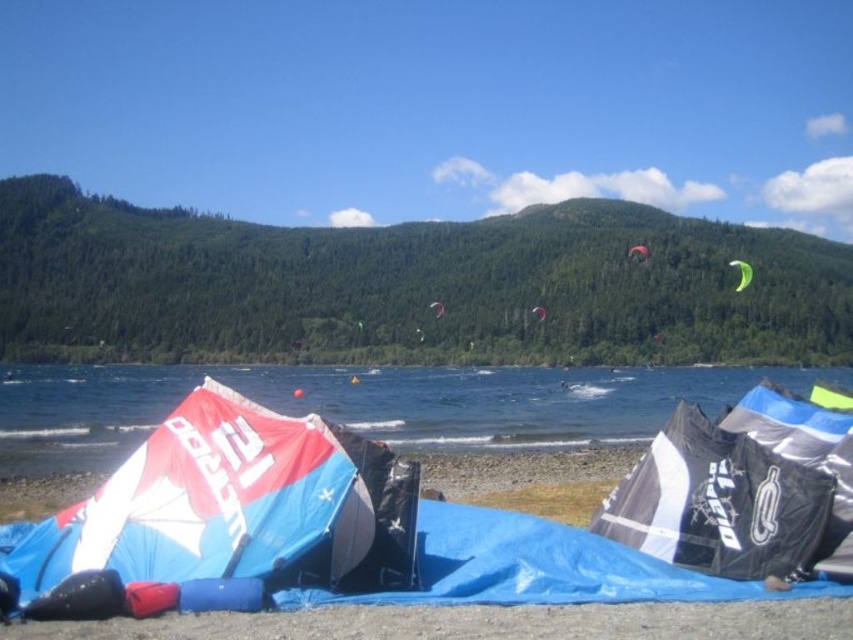
Can you confirm if black matte kite at right is shorter than white matte parachute at center?

Yes.

Is black matte kite at right bigger than white matte parachute at center?

No.

Who is more distant from viewer, (730, 508) or (437, 314)?

Point (437, 314)

This screenshot has width=853, height=640. I want to click on black matte kite at right, so click(741, 492).

What do you see at coordinates (364, 404) in the screenshot? This screenshot has width=853, height=640. I see `blue fabric at lower center` at bounding box center [364, 404].

Where is `blue fabric at lower center`? This screenshot has width=853, height=640. blue fabric at lower center is located at coordinates 364,404.

Which is in front, point (747, 280) or point (643, 248)?

Point (747, 280) is in front.

Where is `green matte parachute at upper right`? The image size is (853, 640). green matte parachute at upper right is located at coordinates (741, 273).

You are a GUI agent. You are given a task and a screenshot of the screen. Output one action in this format:
    pyautogui.click(x=<x>, y=<y>)
    Task: Click on the green matte parachute at upper right
    Image resolution: width=853 pixels, height=640 pixels.
    Given the screenshot: What is the action you would take?
    pyautogui.click(x=741, y=273)